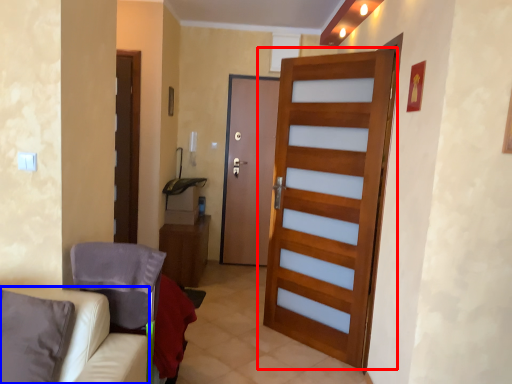
Question: Which point is closer to the camera, door (highlighted by a red box) or furniture (highlighted by a blue box)?

Choices:
 (A) door
 (B) furniture

Answer: (B)